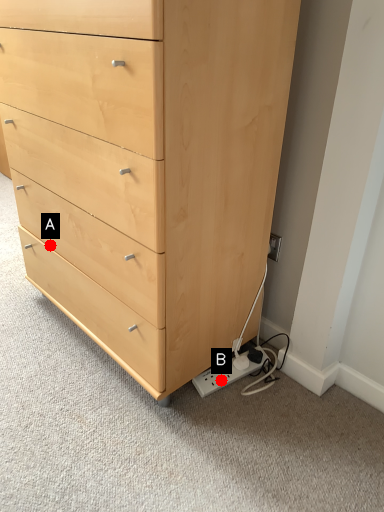
Question: Two points are circled on the image, labeled by A and B beside each circle. Which point is farther to the camera?

Choices:
 (A) A is further
 (B) B is further

Answer: (A)